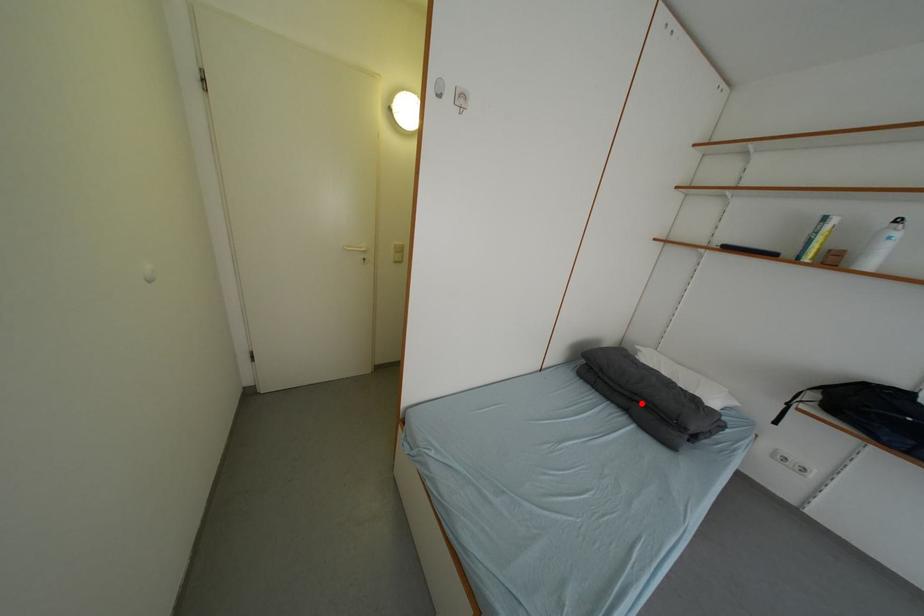
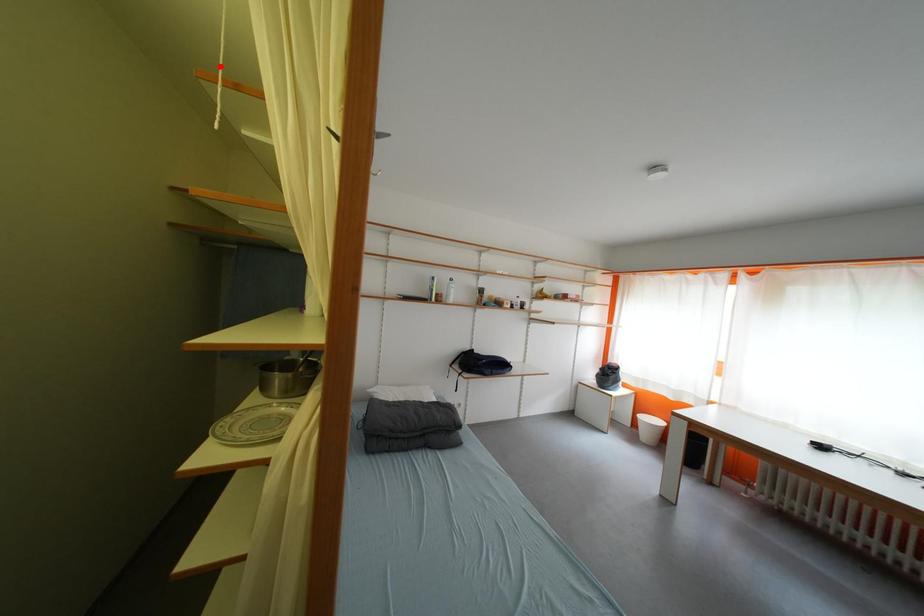
I am providing you with two images of the same scene from different viewpoints. A red point is marked on the first image and another point is marked on the second image. Is the marked point in image1 the same physical position as the marked point in image2?

No